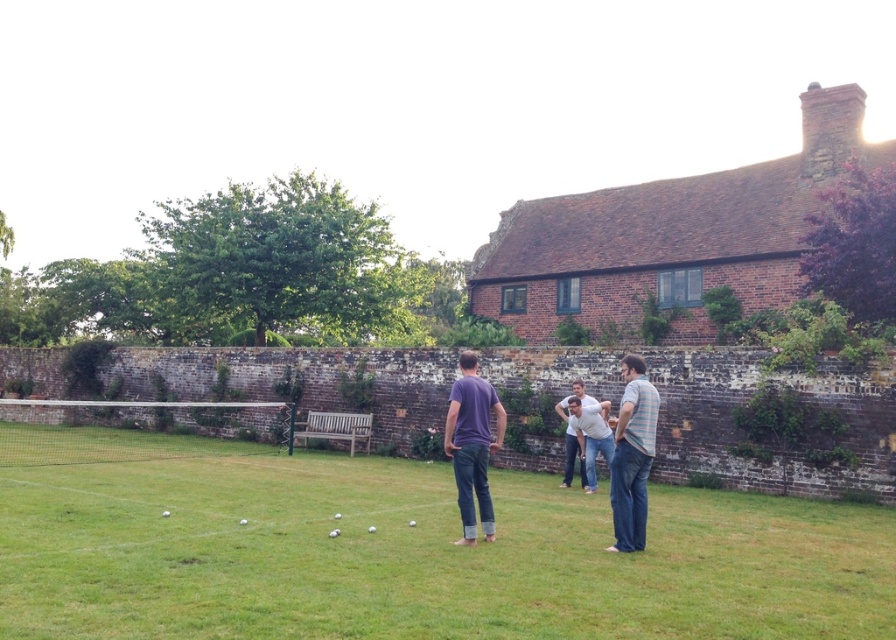
Between green grass at center and denim jeans at center, which one is positioned lower?

Positioned lower is green grass at center.

Which of these two, green grass at center or denim jeans at center, stands shorter?

green grass at center is shorter.

The image size is (896, 640). Describe the element at coordinates (402, 550) in the screenshot. I see `green grass at center` at that location.

This screenshot has height=640, width=896. I want to click on green grass at center, so click(x=402, y=550).

Is striped cotton shirt at center above denim jeans at center?

Correct, striped cotton shirt at center is located above denim jeans at center.

Which is in front, point (631, 412) or point (592, 436)?

Point (631, 412) is in front.

Find the location of a particular element. This screenshot has height=640, width=896. striped cotton shirt at center is located at coordinates (632, 456).

Is green grass at center to the left of purple cotton shirt at center from the viewer's perspective?

Indeed, green grass at center is positioned on the left side of purple cotton shirt at center.

Which is behind, point (866, 554) or point (468, 353)?

Positioned behind is point (468, 353).

Who is more distant from viewer, [168,548] or [471,506]?

The point [471,506] is more distant.

I want to click on green grass at center, so click(x=402, y=550).